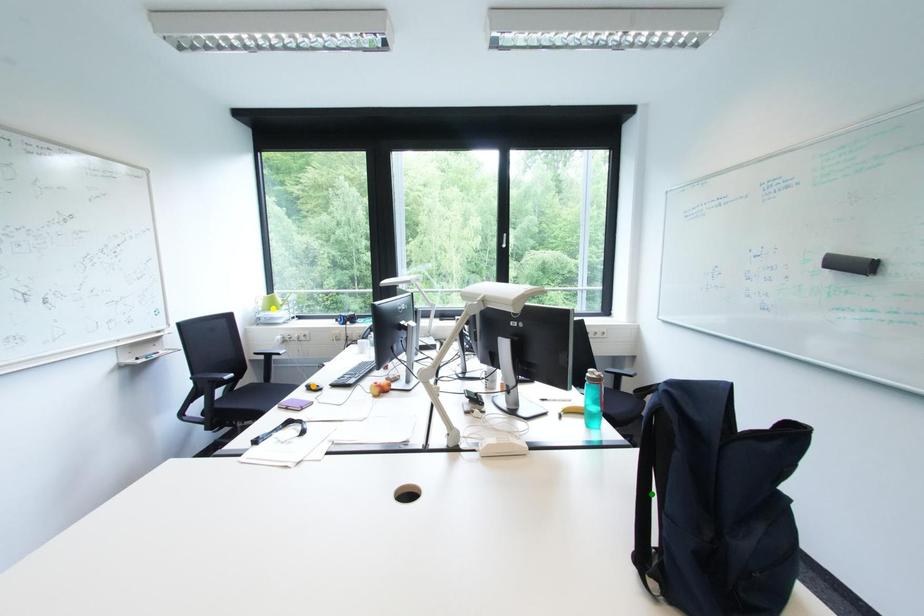
Order these from nearest to farthest:
1. yellow point
2. orange point
3. green point

1. yellow point
2. orange point
3. green point